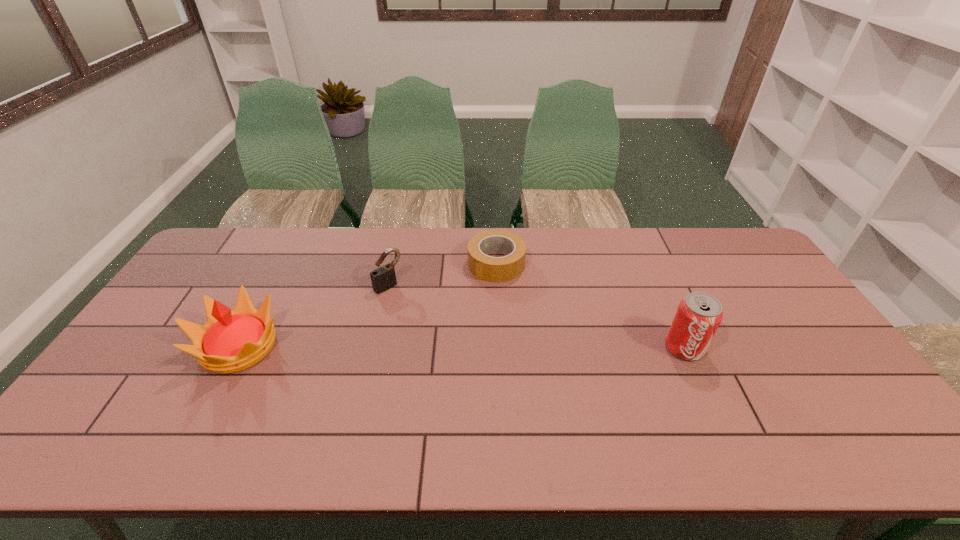
This screenshot has width=960, height=540. I want to click on free space between the leftmost object and the second shortest object, so click(314, 316).

In order to click on object that can be found as the second closest to the third tallest object in this screenshot , I will do `click(231, 341)`.

Identify the location of object that can be found as the second closest to the leftmost object. (493, 269).

In order to click on free space that satisfies the following two spatial constraints: 1. on the back side of the shortest object; 2. on the right side of the leftmost object in this screenshot , I will do `click(283, 264)`.

Where is `vacant area that satisfies the following two spatial constraints: 1. on the back side of the second shortest object; 2. on the right side of the shortest object`? This screenshot has width=960, height=540. vacant area that satisfies the following two spatial constraints: 1. on the back side of the second shortest object; 2. on the right side of the shortest object is located at coordinates (394, 264).

Where is `free spot that satisfies the following two spatial constraints: 1. on the back side of the leftmost object; 2. on the right side of the second shortest object`? free spot that satisfies the following two spatial constraints: 1. on the back side of the leftmost object; 2. on the right side of the second shortest object is located at coordinates (272, 286).